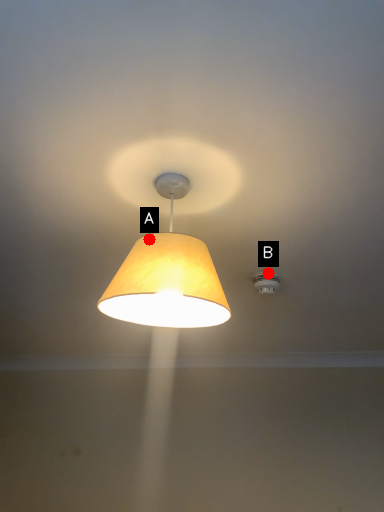
Question: Two points are circled on the image, labeled by A and B beside each circle. Which of the following is the closest to the observer?

Choices:
 (A) A is closer
 (B) B is closer

Answer: (A)